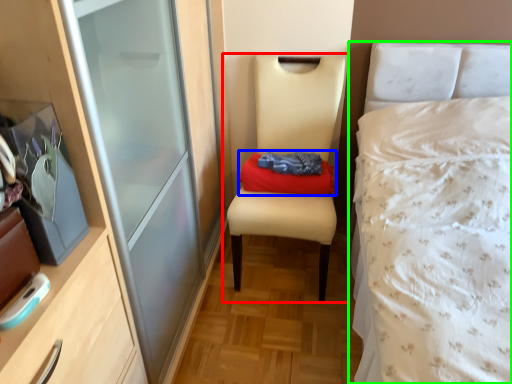
Question: Which object is positioned farthest from chair (highlighted by a red box)? Select from clothing (highlighted by a blue box) and bed (highlighted by a green box).

Choices:
 (A) clothing
 (B) bed

Answer: (B)